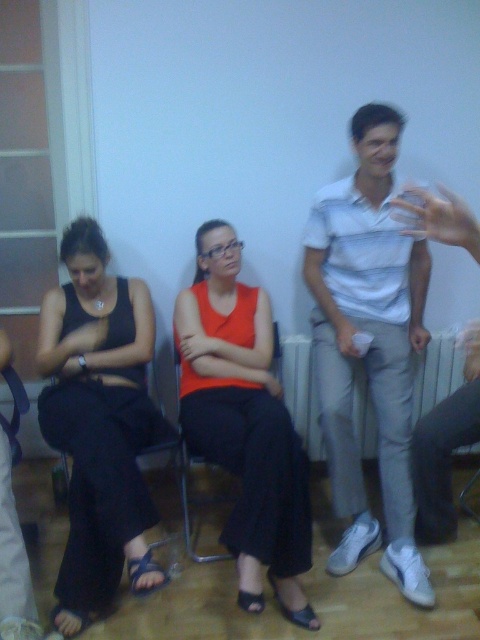
Please look at the image and identify which object the point at coordinates (370, 344) is located on. The available options are the two women described in the scene. The first woman is wearing a black sleeveless top and black pants, and the second woman is wearing a bright orange sleeveless top and dark pants. The point is on one of their clothing items. Which one?

The point at coordinates (370, 344) is located on the white striped shirt at center.

You are organizing a charity event and need to decide which clothing item to display first. The black fabric dress at left and the white cotton shirt at center are both options. Based on their sizes, which one should you choose if you want to start with the larger piece?

The black fabric dress at left might be wider than the white cotton shirt at center, so you should choose the black fabric dress at left to display first as it could be the larger piece.

You are a photographer standing in the room. You want to take a closeup photo of the black fabric dress at left without moving any objects. Can you move closer to the dress to get a better shot?

The black fabric dress at left is 1.75 meters away from the camera. Since you can move closer, you can reduce the distance to achieve a better closeup shot.